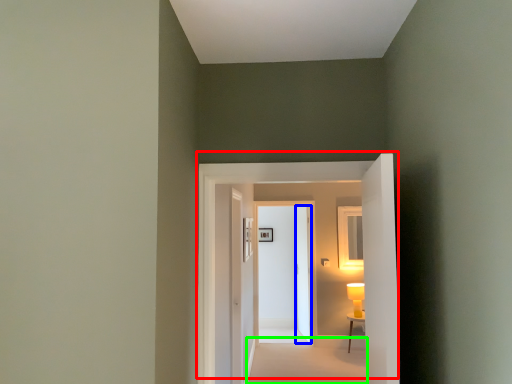
Question: Which is farther away from door (highlighted by a red box)? door (highlighted by a blue box) or path (highlighted by a green box)?

Choices:
 (A) door
 (B) path

Answer: (A)